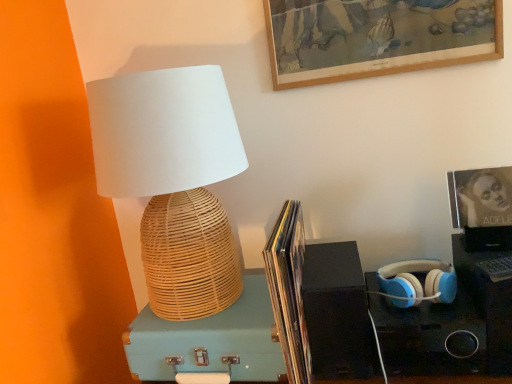
Measure the distance between point (508,180) and camera.

Point (508,180) and camera are 34.13 inches apart from each other.

Locate an element on the screen. The height and width of the screenshot is (384, 512). wooden picture frame at upper center, which is the second picture frame from bottom to top is located at coordinates (374, 39).

What are the coordinates of `light blue wicker suitcase at center` in the screenshot? It's located at (210, 341).

You are a GUI agent. You are given a task and a screenshot of the screen. Output one action in this format:
    pyautogui.click(x=<x>, y=<y>)
    Task: Click on the woven bamboo lamp at left
    
    Given the screenshot: What is the action you would take?
    pyautogui.click(x=173, y=180)

Looking at this image, from their relative heights in the image, would you say black matte speaker at lower right is taller or shorter than blue matte headphones at right?

black matte speaker at lower right is taller than blue matte headphones at right.

Would you say black matte speaker at lower right is a long distance from blue matte headphones at right?

No, black matte speaker at lower right is not far from blue matte headphones at right.

From the picture: Which point is more distant from viewer, [327,336] or [416,305]?

Point [327,336]

Considering the positions of objects black matte speaker at lower right and woven bamboo lamp at left in the image provided, who is in front, black matte speaker at lower right or woven bamboo lamp at left?

woven bamboo lamp at left is more forward.

Does black matte speaker at lower right have a smaller size compared to woven bamboo lamp at left?

Indeed, black matte speaker at lower right has a smaller size compared to woven bamboo lamp at left.

Are black matte speaker at lower right and woven bamboo lamp at left located far from each other?

No, black matte speaker at lower right is not far from woven bamboo lamp at left.

Between black matte speaker at lower right and woven bamboo lamp at left, which one has smaller width?

black matte speaker at lower right.

Where is `headphones on the right of matte paper book at center`? The image size is (512, 384). headphones on the right of matte paper book at center is located at coordinates pyautogui.click(x=417, y=282).

Would you consider blue matte headphones at right to be distant from matte paper book at center?

No, blue matte headphones at right is in close proximity to matte paper book at center.

Does point (422, 298) appear closer or farther from the camera than point (294, 309)?

Clearly, point (422, 298) is more distant from the camera than point (294, 309).

Which object is positioned more to the left, blue matte headphones at right or matte paper book at center?

matte paper book at center.

Are light blue wicker suitcase at center and woven bamboo lamp at left making contact?

No, light blue wicker suitcase at center is not beside woven bamboo lamp at left.

Is light blue wicker suitcase at center looking in the opposite direction of woven bamboo lamp at left?

That's not correct — light blue wicker suitcase at center is not looking away from woven bamboo lamp at left.

Which is nearer, [191,339] or [189,250]?

Clearly, point [191,339] is closer to the camera than point [189,250].

From the image's perspective, between light blue wicker suitcase at center and woven bamboo lamp at left, which one is located above?

woven bamboo lamp at left appears higher in the image.

Considering the positions of objects matte black album cover at upper right, placed as the first picture frame when sorted from bottom to top, and light blue wicker suitcase at center in the image provided, who is more to the left, matte black album cover at upper right, placed as the first picture frame when sorted from bottom to top, or light blue wicker suitcase at center?

From the viewer's perspective, light blue wicker suitcase at center appears more on the left side.

Is point (499, 247) closer or farther from the camera than point (236, 330)?

Clearly, point (499, 247) is closer to the camera than point (236, 330).

Who is taller, matte black album cover at upper right, which ranks as the second picture frame in top-to-bottom order, or light blue wicker suitcase at center?

matte black album cover at upper right, which ranks as the second picture frame in top-to-bottom order, is taller.

Considering the points (229, 362) and (289, 334), which point is in front, point (229, 362) or point (289, 334)?

The point (289, 334) is more forward.

Do you think light blue wicker suitcase at center is within matte paper book at center, or outside of it?

light blue wicker suitcase at center is located beyond the bounds of matte paper book at center.

How many degrees apart are the facing directions of light blue wicker suitcase at center and matte paper book at center?

1.05 degrees.

From the image's perspective, is light blue wicker suitcase at center beneath matte paper book at center?

Indeed, from the image's perspective, light blue wicker suitcase at center is shown beneath matte paper book at center.

Looking at this image, from a real-world perspective, which is physically above, black matte speaker at lower right or matte black album cover at upper right, placed as the first picture frame when sorted from bottom to top?

matte black album cover at upper right, placed as the first picture frame when sorted from bottom to top.

In the scene shown: Does black matte speaker at lower right come behind matte black album cover at upper right, which ranks as the second picture frame in top-to-bottom order?

No, the depth of black matte speaker at lower right is less than that of matte black album cover at upper right, which ranks as the second picture frame in top-to-bottom order.

Does point (359, 314) appear closer or farther from the camera than point (490, 233)?

Point (359, 314).

Is matte black album cover at upper right, placed as the first picture frame when sorted from bottom to top, a part of black matte speaker at lower right?

No, matte black album cover at upper right, placed as the first picture frame when sorted from bottom to top, is located outside of black matte speaker at lower right.

Where is `speaker below the blue matte headphones at right (from a real-world perspective)`? speaker below the blue matte headphones at right (from a real-world perspective) is located at coordinates (337, 313).

The height and width of the screenshot is (384, 512). I want to click on lamp above the black matte speaker at lower right (from a real-world perspective), so click(173, 180).

Estimate the real-world distances between objects in this image. Which object is further from light blue wicker suitcase at center, matte paper book at center or matte black album cover at upper right, which ranks as the second picture frame in top-to-bottom order?

Among the two, matte black album cover at upper right, which ranks as the second picture frame in top-to-bottom order, is located further to light blue wicker suitcase at center.

Estimate the real-world distances between objects in this image. Which object is closer to wooden picture frame at upper center, the first picture frame when ordered from top to bottom, matte paper book at center or woven bamboo lamp at left?

Based on the image, woven bamboo lamp at left appears to be nearer to wooden picture frame at upper center, the first picture frame when ordered from top to bottom.

Estimate the real-world distances between objects in this image. Which object is further from matte paper book at center, black matte speaker at lower right or woven bamboo lamp at left?

Among the two, woven bamboo lamp at left is located further to matte paper book at center.

Estimate the real-world distances between objects in this image. Which object is closer to matte paper book at center, black matte speaker at lower right or matte black album cover at upper right, which ranks as the second picture frame in top-to-bottom order?

black matte speaker at lower right.

Based on their spatial positions, is blue matte headphones at right or black matte speaker at lower right closer to light blue wicker suitcase at center?

Among the two, black matte speaker at lower right is located nearer to light blue wicker suitcase at center.

From the image, which object appears to be farther from matte black album cover at upper right, which ranks as the second picture frame in top-to-bottom order, light blue wicker suitcase at center or matte paper book at center?

light blue wicker suitcase at center is positioned further to the anchor matte black album cover at upper right, which ranks as the second picture frame in top-to-bottom order.

Considering their positions, is matte black album cover at upper right, placed as the first picture frame when sorted from bottom to top, positioned further to matte paper book at center than wooden picture frame at upper center, which is the second picture frame from bottom to top?

Among the two, wooden picture frame at upper center, which is the second picture frame from bottom to top, is located further to matte paper book at center.

From the image, which object appears to be farther from matte black album cover at upper right, placed as the first picture frame when sorted from bottom to top, woven bamboo lamp at left or light blue wicker suitcase at center?

Among the two, woven bamboo lamp at left is located further to matte black album cover at upper right, placed as the first picture frame when sorted from bottom to top.

Locate an element on the screen. picture frame located between woven bamboo lamp at left and matte black album cover at upper right, placed as the first picture frame when sorted from bottom to top, in the left-right direction is located at coordinates (374, 39).

Identify the location of book located between woven bamboo lamp at left and matte black album cover at upper right, which ranks as the second picture frame in top-to-bottom order, in the left-right direction. This screenshot has height=384, width=512. (289, 290).

Image resolution: width=512 pixels, height=384 pixels. I want to click on book between woven bamboo lamp at left and light blue wicker suitcase at center vertically, so click(289, 290).

This screenshot has width=512, height=384. In order to click on book between wooden picture frame at upper center, the first picture frame when ordered from top to bottom, and black matte speaker at lower right vertically in this screenshot , I will do `click(289, 290)`.